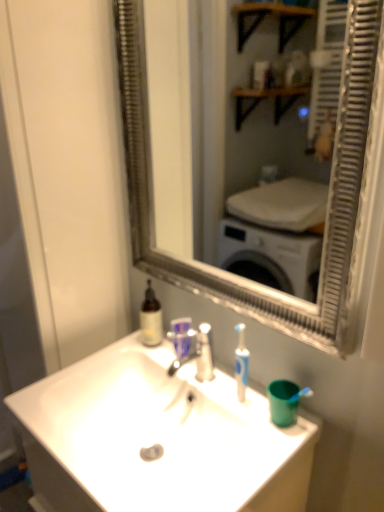
Locate an element on the screen. blank space to the left of translucent plastic mouthwash at center is located at coordinates coord(141,355).